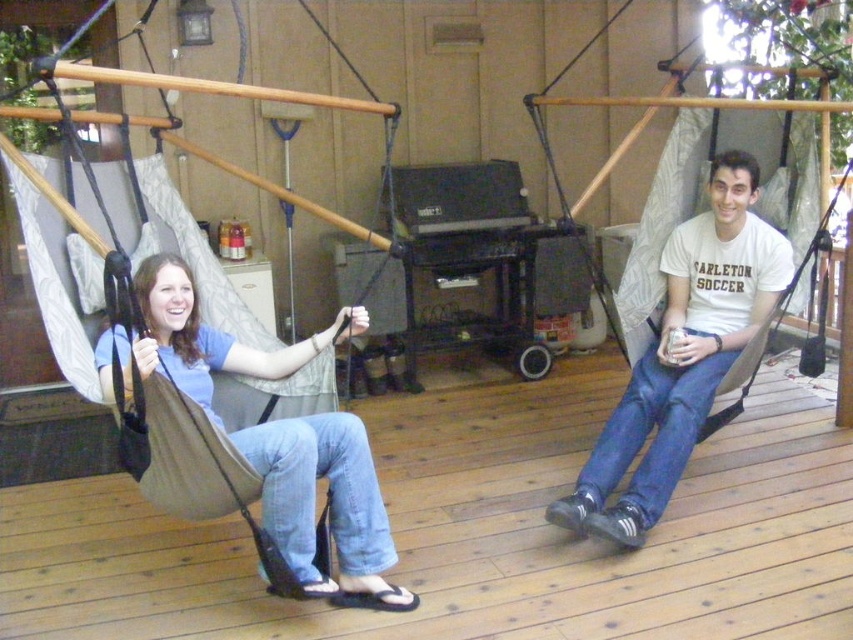
Question: Which of the following is the closest to the observer?

Choices:
 (A) white cotton t-shirt at center
 (B) matte beige hammock at left

Answer: (B)

Question: Is wooden deck at center wider than matte beige hammock at left?

Choices:
 (A) yes
 (B) no

Answer: (A)

Question: Which point is farther to the camera?

Choices:
 (A) (285, 374)
 (B) (602, 461)

Answer: (B)

Question: Which of the following is the closest to the observer?

Choices:
 (A) matte beige hammock at left
 (B) white cotton t-shirt at center
 (C) wooden deck at center

Answer: (A)

Question: Is wooden deck at center positioned before matte beige hammock at left?

Choices:
 (A) yes
 (B) no

Answer: (B)

Question: Can you confirm if wooden deck at center is positioned below white cotton t-shirt at center?

Choices:
 (A) no
 (B) yes

Answer: (B)